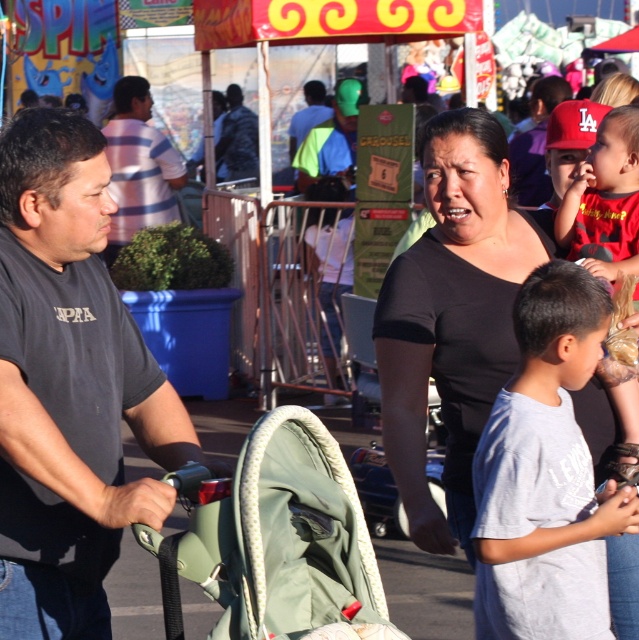
You are at a carnival and see two people wearing shirts. The first person is wearing a striped cotton shirt at left and the second is wearing a blue fabric shirt at center. Which shirt is positioned more to the left?

The striped cotton shirt at left is positioned more to the left than the blue fabric shirt at center.

What is the 2D coordinate of the striped cotton shirt at left in the image?

The striped cotton shirt at left is located at the 2D coordinate point of (139, 164).